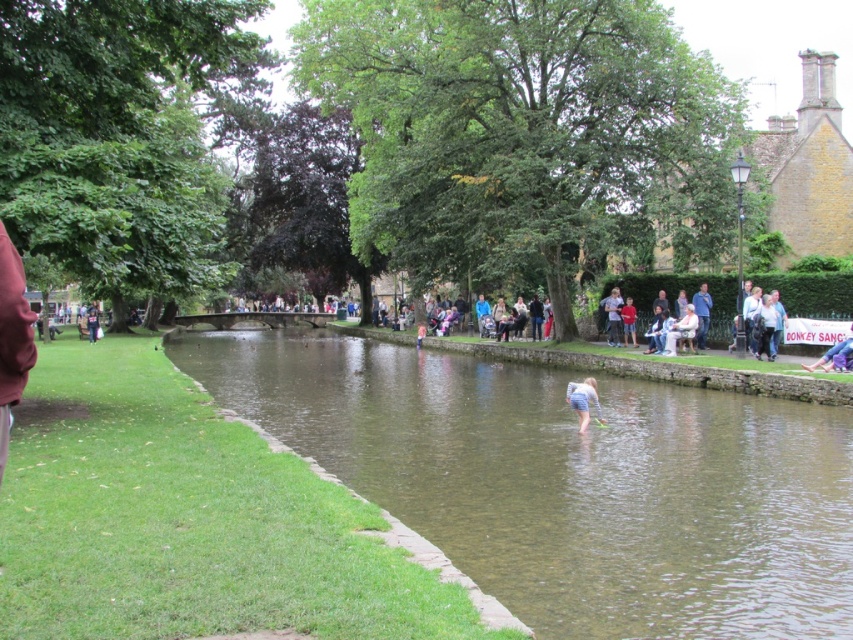
Question: Does blue denim shorts at center appear over light blue denim shorts at center?

Choices:
 (A) yes
 (B) no

Answer: (B)

Question: Can you confirm if blue denim shorts at lower center is smaller than blue denim shorts at center?

Choices:
 (A) no
 (B) yes

Answer: (B)

Question: Which of the following is the farthest from the observer?

Choices:
 (A) (809, 371)
 (B) (814, 614)
 (C) (619, 308)
 (D) (581, 388)

Answer: (C)

Question: Considering the relative positions of blue denim shorts at lower center and light blue denim shorts at center in the image provided, where is blue denim shorts at lower center located with respect to light blue denim shorts at center?

Choices:
 (A) right
 (B) left

Answer: (B)

Question: Which object is farther from the camera taking this photo?

Choices:
 (A) blue denim shorts at center
 (B) light blue denim shorts at center
 (C) clear water at center
 (D) blue denim shorts at lower center

Answer: (B)

Question: Which of the following is the closest to the observer?

Choices:
 (A) (749, 570)
 (B) (611, 298)
 (C) (834, 364)
 (D) (582, 404)

Answer: (A)